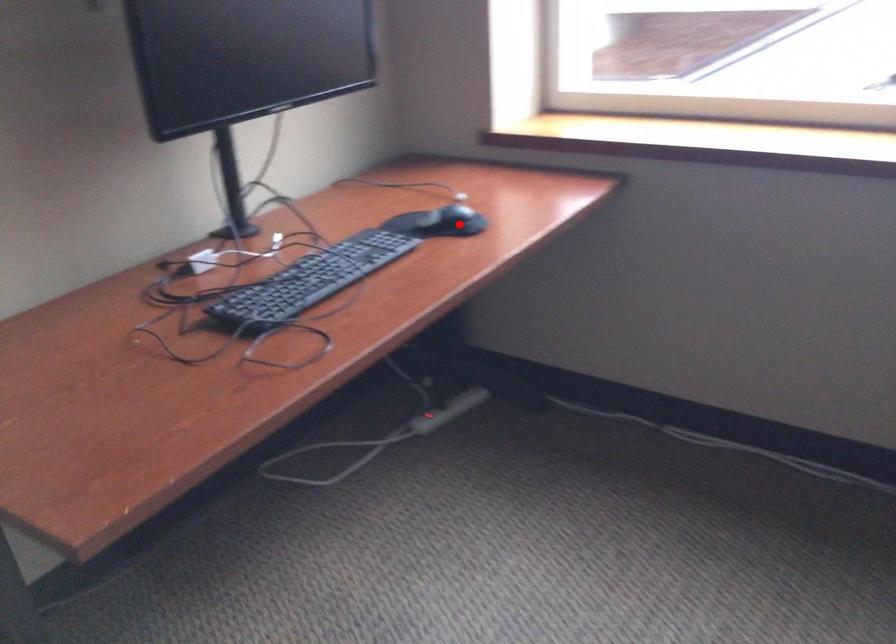
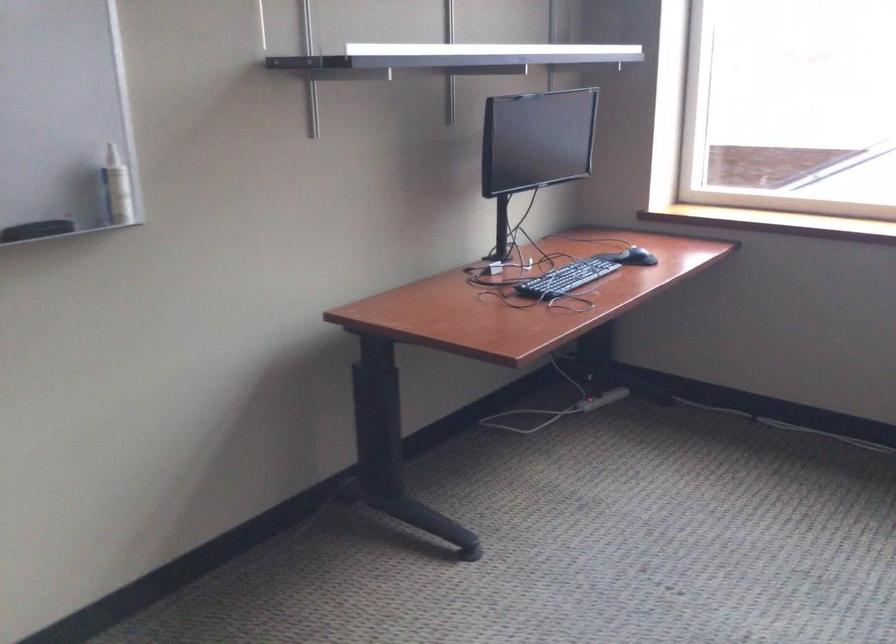
Locate, in the second image, the point that corresponds to the highlighted location in the first image.

(636, 257)